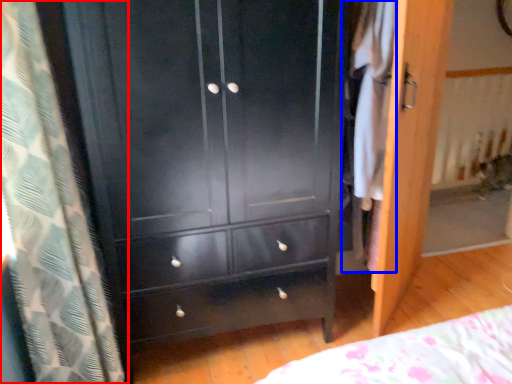
Question: Which object appears closest to the camera in this image, curtain (highlighted by a red box) or clothing (highlighted by a blue box)?

Choices:
 (A) curtain
 (B) clothing

Answer: (A)